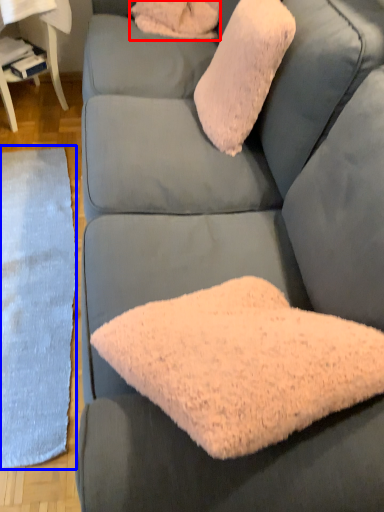
Question: Which object appears farthest to the camera in this image, pillow (highlighted by a red box) or mat (highlighted by a blue box)?

Choices:
 (A) pillow
 (B) mat

Answer: (A)